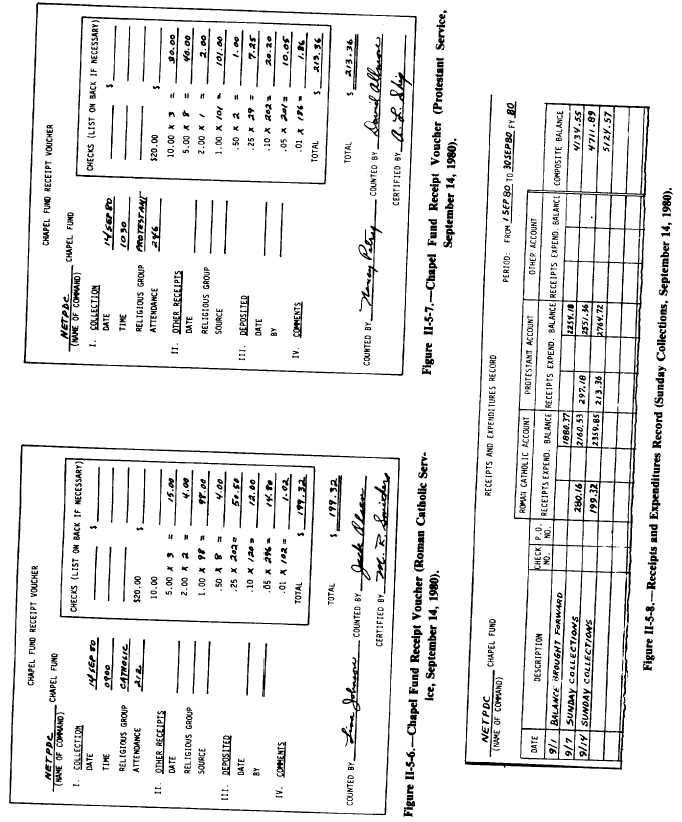
Where is `column`? column is located at coordinates (535, 744), (532, 689), (545, 548), (544, 533), (543, 499), (544, 368), (552, 264), (554, 155).